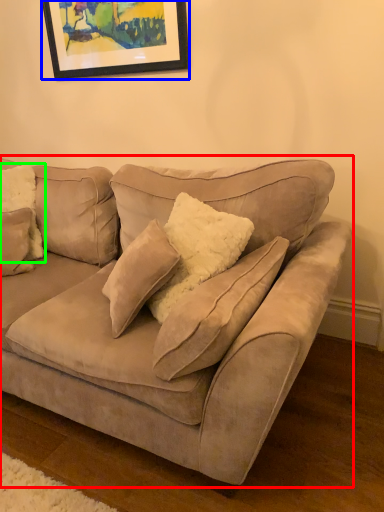
Question: Estimate the real-world distances between objects in this image. Which object is closer to studio couch (highlighted by a red box), picture frame (highlighted by a blue box) or pillow (highlighted by a green box)?

Choices:
 (A) picture frame
 (B) pillow

Answer: (B)